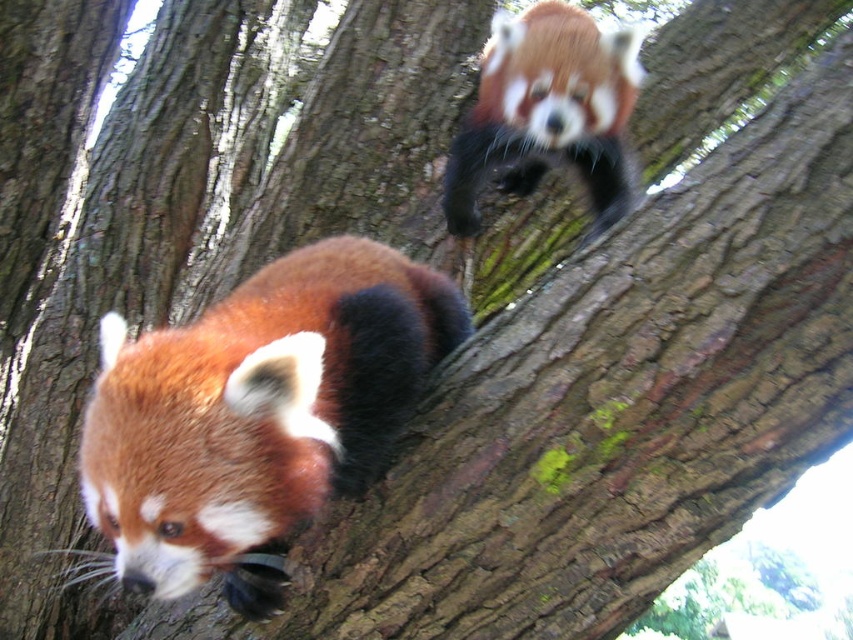
Between fluffy reddish-brown fur at lower left and fluffy reddish-brown fur at upper center, which one is positioned higher?

fluffy reddish-brown fur at upper center

Measure the distance between fluffy reddish-brown fur at lower left and camera.

A distance of 1.01 meters exists between fluffy reddish-brown fur at lower left and camera.

What are the coordinates of `fluffy reddish-brown fur at lower left` in the screenshot? It's located at (257, 413).